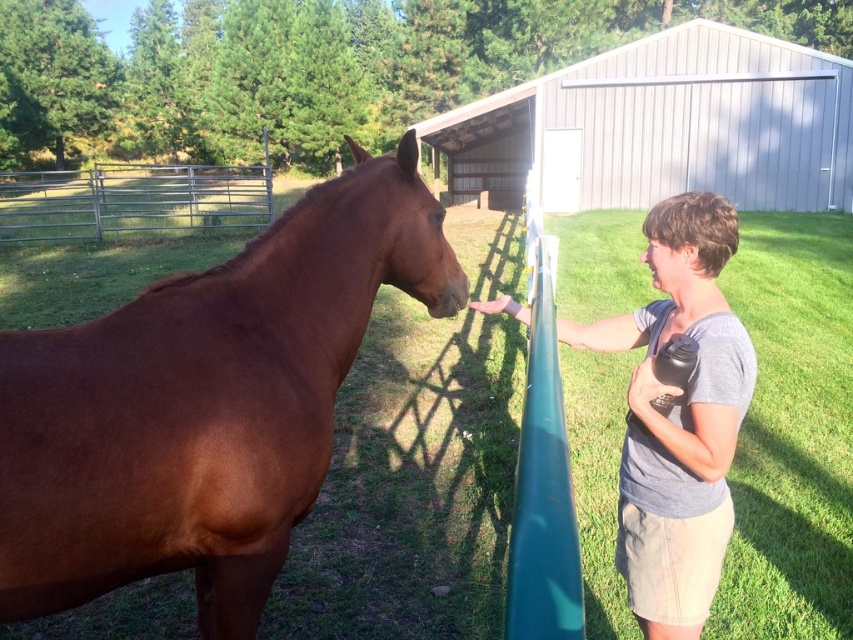
Question: Can you confirm if gray cotton shirt at center is bigger than metallic silver fence at upper left?

Choices:
 (A) no
 (B) yes

Answer: (A)

Question: Is brown glossy horse at left to the right of metallic silver fence at upper left from the viewer's perspective?

Choices:
 (A) no
 (B) yes

Answer: (B)

Question: Estimate the real-world distances between objects in this image. Which object is closer to the gray cotton shirt at center?

Choices:
 (A) brown glossy horse at left
 (B) metallic silver fence at upper left

Answer: (A)

Question: Among these objects, which one is farthest from the camera?

Choices:
 (A) gray cotton shirt at center
 (B) brown glossy horse at left
 (C) metallic silver fence at upper left

Answer: (C)

Question: In this image, where is brown glossy horse at left located relative to gray cotton shirt at center?

Choices:
 (A) right
 (B) left

Answer: (B)

Question: Which point is closer to the camera?

Choices:
 (A) (125, 198)
 (B) (215, 374)

Answer: (B)